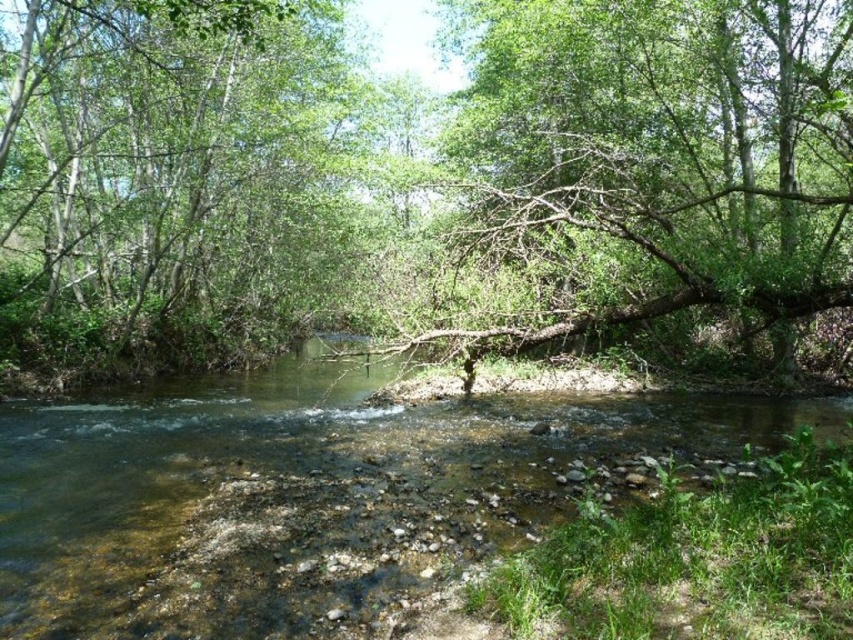
In the scene shown: You are a hiker trying to cross the stream. You see the brown rough tree trunk at center and the green leafy tree at left. Which one would you use as a bridge to cross the stream?

The brown rough tree trunk at center is larger in size than the green leafy tree at left, so it would be more stable and suitable to use as a bridge to cross the stream.